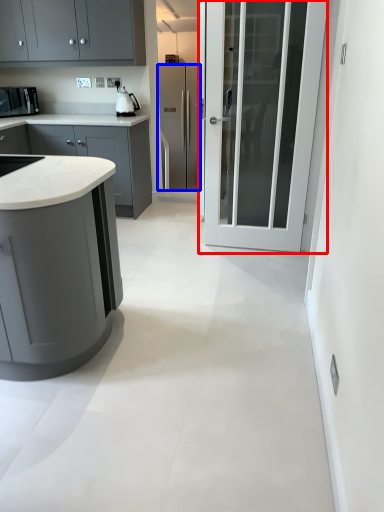
Question: Which object appears closest to the camera in this image, door (highlighted by a red box) or refrigerator (highlighted by a blue box)?

Choices:
 (A) door
 (B) refrigerator

Answer: (A)